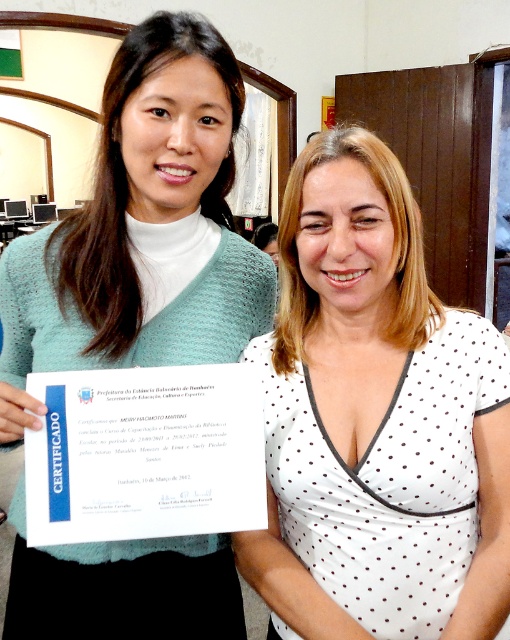
From the picture: You are a photographer setting up for a group photo. You have a camera with a 50mm lens that has a maximum aperture of f1.8. You want to ensure both the white dotted dress at center and the teal knitted sweater at left are in focus. Given the distance between them is 8.71 inches, what is the minimum distance you should stand from the subjects to achieve this depth of field?

To ensure both the white dotted dress at center and the teal knitted sweater at left are in focus with a 50mm lens at f1.8, you should position yourself at least 10 feet away from the subjects. This distance provides sufficient depth of field to cover the 8.71 inch gap between them.

You are a photographer setting up for an event. You need to adjust the lighting so that the white dotted dress at center is fully visible without the teal knitted sweater at left blocking it. What adjustment should you make?

The white dotted dress at center is already in front of the teal knitted sweater at left, so no adjustment is needed as the dress is already visible without obstruction from the sweater.

You are a photographer adjusting your camera settings to capture a clear image of the certificate held by the woman on the left. The camera can focus on objects within a 30 inch range. Is the point at coordinates point at point (x=388, y=458) within the camera focus range?

The point at point (x=388, y=458) is 32.66 inches from the camera, which is beyond the 30 inch focus range. The camera cannot focus on it clearly.